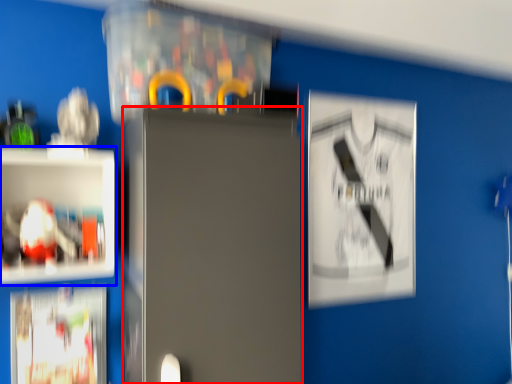
Question: Which of the following is the closest to the observer, fridge (highlighted by a red box) or shelf (highlighted by a blue box)?

Choices:
 (A) fridge
 (B) shelf

Answer: (A)